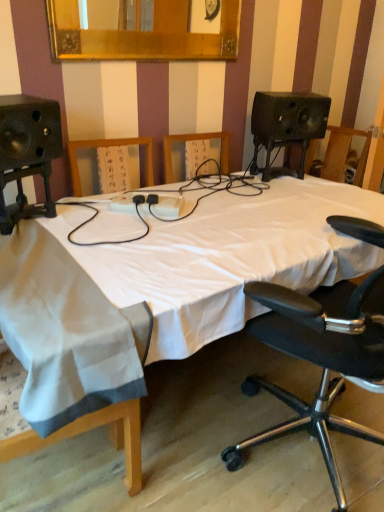
Question: Considering the positions of point (79, 44) and point (314, 346), is point (79, 44) closer or farther from the camera than point (314, 346)?

Choices:
 (A) farther
 (B) closer

Answer: (A)

Question: From a real-world perspective, relative to black leather office chair at right, is gold-framed mirror at upper center vertically above or below?

Choices:
 (A) above
 (B) below

Answer: (A)

Question: Estimate the real-world distances between objects in this image. Which object is farther from the black leather office chair at right?

Choices:
 (A) white fabric bed at center
 (B) white cloth at left
 (C) gold-framed mirror at upper center

Answer: (C)

Question: Estimate the real-world distances between objects in this image. Which object is farther from the black leather office chair at right?

Choices:
 (A) white cloth at left
 (B) gold-framed mirror at upper center
 (C) white fabric bed at center

Answer: (B)